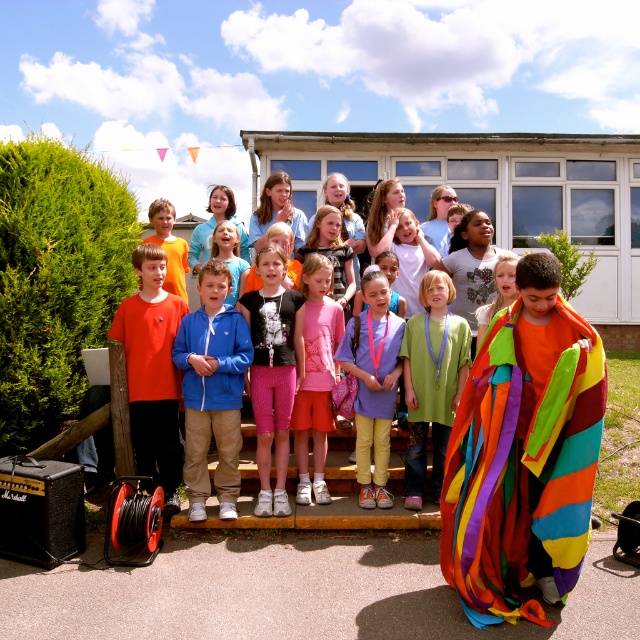
Question: Among these objects, which one is nearest to the camera?

Choices:
 (A) matte orange shirt at left
 (B) blue fleece jacket at center

Answer: (B)

Question: Observing the image, what is the correct spatial positioning of pastel purple fabric at center in reference to pink fabric shorts at center?

Choices:
 (A) right
 (B) left

Answer: (A)

Question: Is pink fabric shorts at center to the left of orange cotton shirt at center from the viewer's perspective?

Choices:
 (A) no
 (B) yes

Answer: (A)

Question: Does green fabric shirt at center appear under orange cotton shirt at center?

Choices:
 (A) no
 (B) yes

Answer: (B)

Question: Which object appears farthest from the camera in this image?

Choices:
 (A) rainbow fabric blanket at right
 (B) green fabric shirt at center
 (C) pink fabric at center
 (D) pastel purple fabric at center

Answer: (C)

Question: Based on their relative distances, which object is nearer to the pink fabric at center?

Choices:
 (A) rainbow fabric blanket at right
 (B) pastel purple fabric at center
 (C) matte orange shirt at left

Answer: (C)